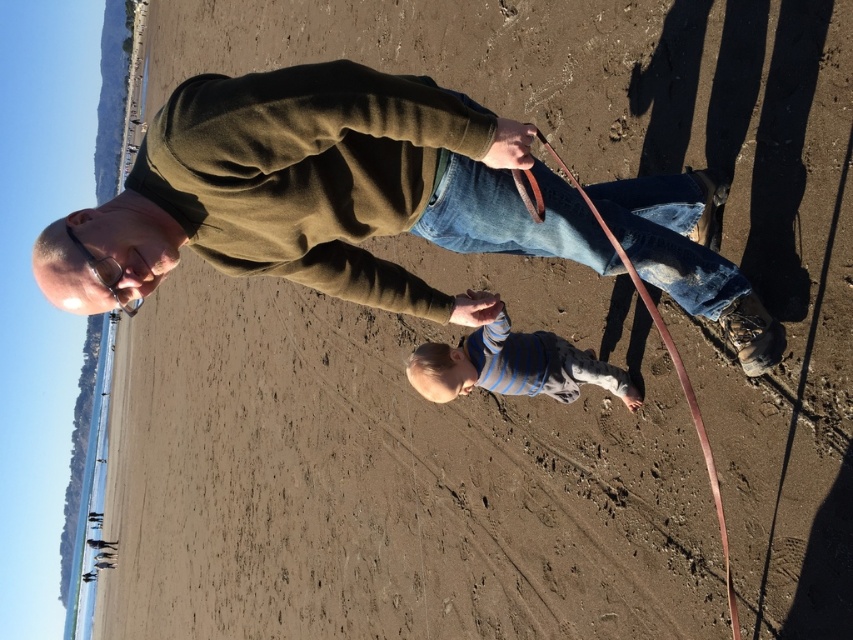
Who is positioned more to the left, matte green sweater at upper center or striped cotton shirt at center?

matte green sweater at upper center is more to the left.

Does matte green sweater at upper center have a smaller size compared to striped cotton shirt at center?

No, matte green sweater at upper center is not smaller than striped cotton shirt at center.

Image resolution: width=853 pixels, height=640 pixels. I want to click on matte green sweater at upper center, so click(x=317, y=193).

Is point (395, 106) positioned behind point (654, 308)?

That is False.

Which is more to the right, matte green sweater at upper center or brown leather leash at lower center?

From the viewer's perspective, brown leather leash at lower center appears more on the right side.

You are a GUI agent. You are given a task and a screenshot of the screen. Output one action in this format:
    pyautogui.click(x=<x>, y=<y>)
    Task: Click on the matte green sweater at upper center
    The height and width of the screenshot is (640, 853).
    Given the screenshot: What is the action you would take?
    pyautogui.click(x=317, y=193)

Between striped cotton shirt at center and brown leather leash at lower center, which one has less height?

Standing shorter between the two is striped cotton shirt at center.

Which is in front, point (552, 340) or point (523, 202)?

Point (523, 202)

Is point (532, 369) positioned before point (544, 141)?

No.

Find the location of a particular element. striped cotton shirt at center is located at coordinates (512, 365).